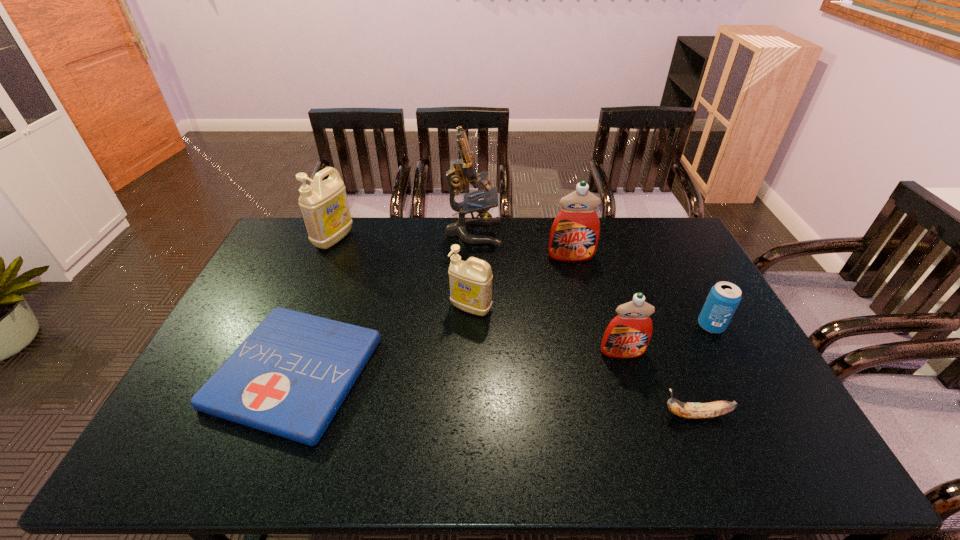
You are a GUI agent. You are given a task and a screenshot of the screen. Output one action in this format:
    pyautogui.click(x=<x>, y=<y>)
    Task: Click on the tallest object
    
    Given the screenshot: What is the action you would take?
    pyautogui.click(x=463, y=171)

The height and width of the screenshot is (540, 960). What are the coordinates of `the bigger beige detergent` in the screenshot? It's located at (324, 205).

At what (x,y) coordinates should I click in order to perform the action: click on the farther beige detergent. Please return your answer as a coordinate pair (x, y). This screenshot has height=540, width=960. Looking at the image, I should click on (324, 205).

Locate an element on the screen. the farther red detergent is located at coordinates (574, 235).

You are a GUI agent. You are given a task and a screenshot of the screen. Output one action in this format:
    pyautogui.click(x=<x>, y=<y>)
    Task: Click on the third detergent from right to left
    The image size is (960, 540).
    Given the screenshot: What is the action you would take?
    pyautogui.click(x=470, y=281)

This screenshot has width=960, height=540. In order to click on the smaller beige detergent in this screenshot , I will do `click(470, 281)`.

You are a GUI agent. You are given a task and a screenshot of the screen. Output one action in this format:
    pyautogui.click(x=<x>, y=<y>)
    Task: Click on the nearer red detergent
    This screenshot has width=960, height=540.
    Given the screenshot: What is the action you would take?
    [x=628, y=334]

The width and height of the screenshot is (960, 540). I want to click on the smaller red detergent, so click(628, 334).

Locate an element on the screen. This screenshot has width=960, height=540. the third shortest object is located at coordinates click(x=724, y=297).

Where is `soda can`? Image resolution: width=960 pixels, height=540 pixels. soda can is located at coordinates pyautogui.click(x=724, y=297).